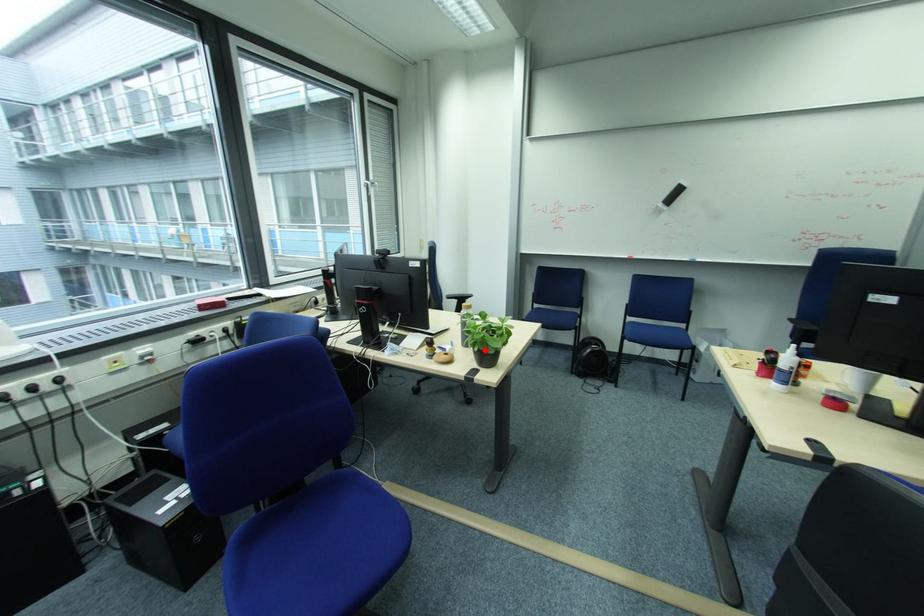
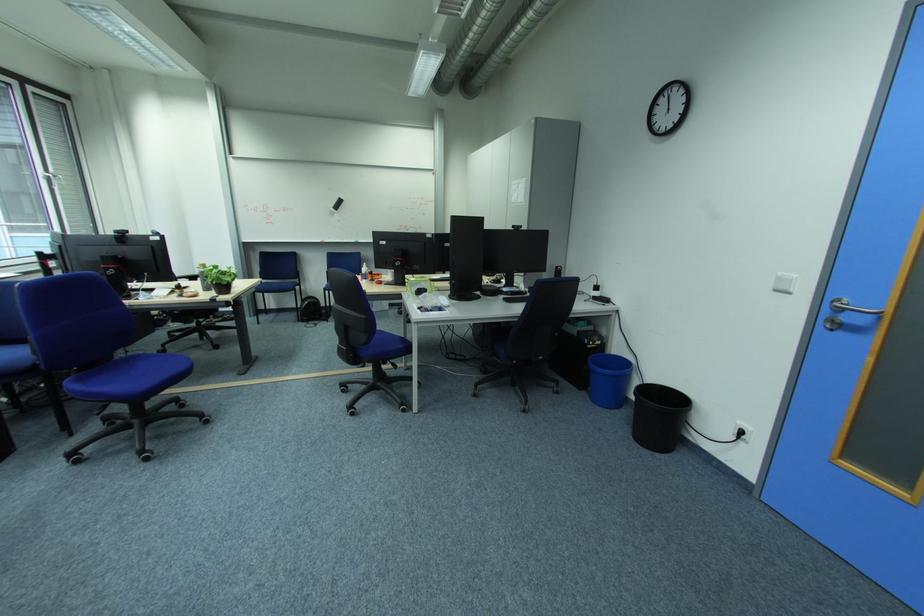
The point at the highlighted location is marked in the first image. Where is the corresponding point in the second image?

(224, 284)